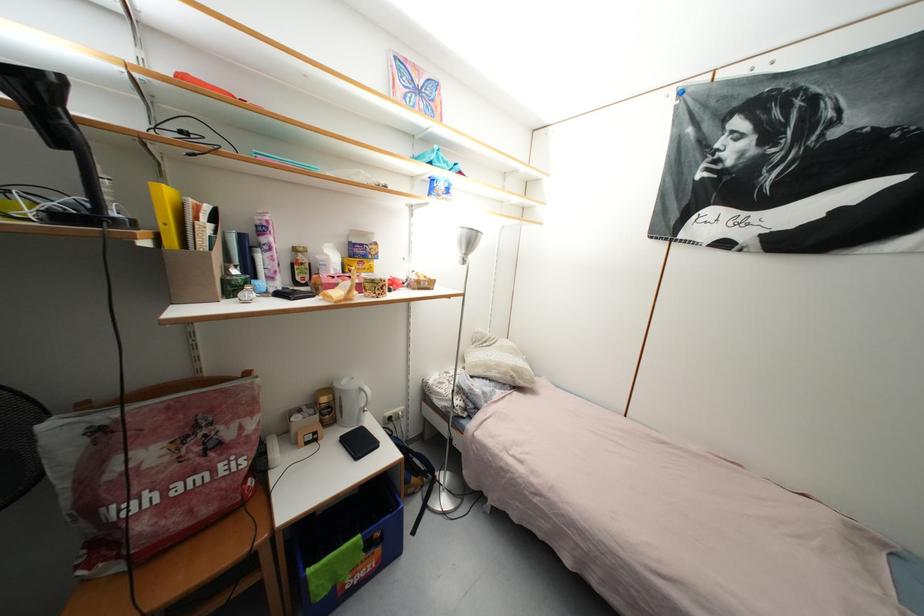
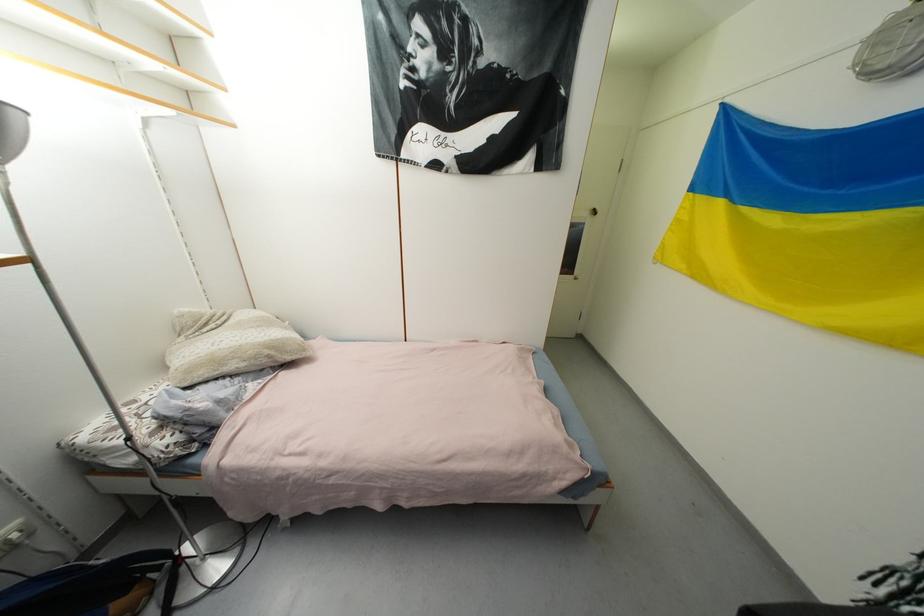
Based on the continuous images, in which direction is the camera rotating?

The camera rotated toward right-down.